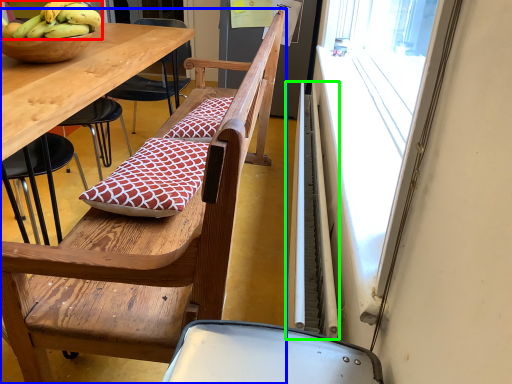
Question: Considering the real-world distances, which object is farthest from banana (highlighted by a red box)? chair (highlighted by a blue box) or radiator (highlighted by a green box)?

Choices:
 (A) chair
 (B) radiator

Answer: (B)